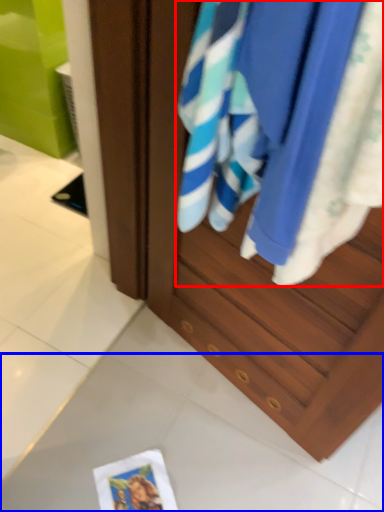
Question: Which object appears closest to the camera in this image, beach towel (highlighted by a red box) or tile (highlighted by a blue box)?

Choices:
 (A) beach towel
 (B) tile

Answer: (A)